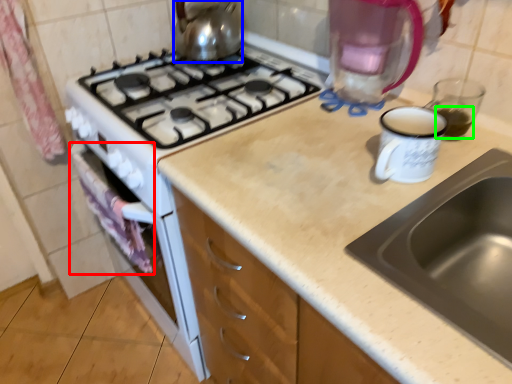
Question: Which object is positioned closest to cloth (highlighted by a red box)? Select from kitchen appliance (highlighted by a blue box) and beverage (highlighted by a green box).

Choices:
 (A) kitchen appliance
 (B) beverage

Answer: (A)